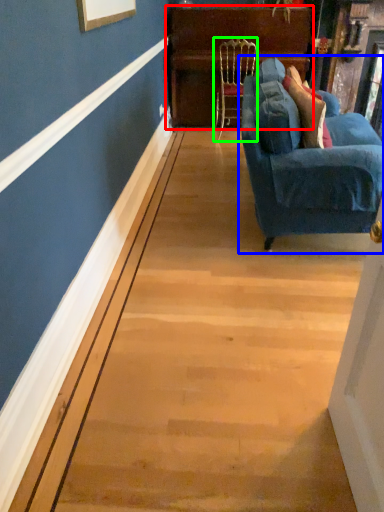
Question: Which object is the farthest from dresser (highlighted by a red box)? Choose among these: studio couch (highlighted by a blue box) or chair (highlighted by a green box).

Choices:
 (A) studio couch
 (B) chair

Answer: (A)